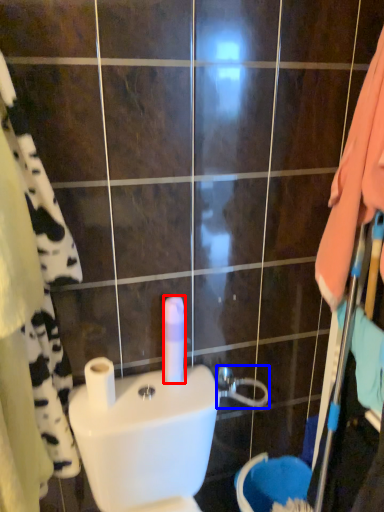
Question: Which object appears closest to the camera in this image, toilet paper (highlighted by a red box) or shower (highlighted by a blue box)?

Choices:
 (A) toilet paper
 (B) shower

Answer: (A)